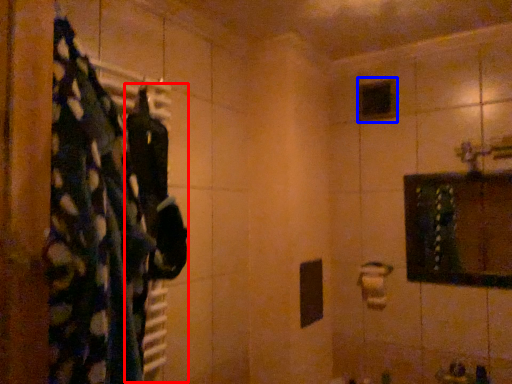
Question: Which object appears closest to the camera in this image, clothing (highlighted by a red box) or mirror (highlighted by a blue box)?

Choices:
 (A) clothing
 (B) mirror

Answer: (A)